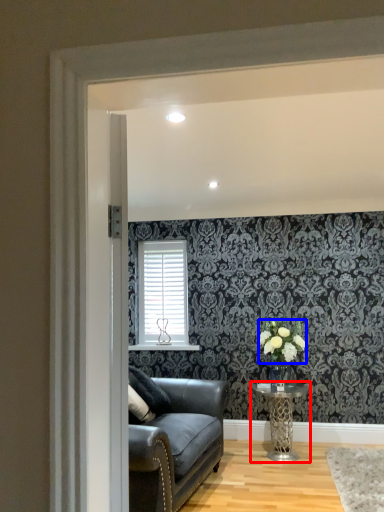
Question: Which object is closer to the camera taking this photo, table (highlighted by a red box) or flower (highlighted by a blue box)?

Choices:
 (A) table
 (B) flower

Answer: (A)